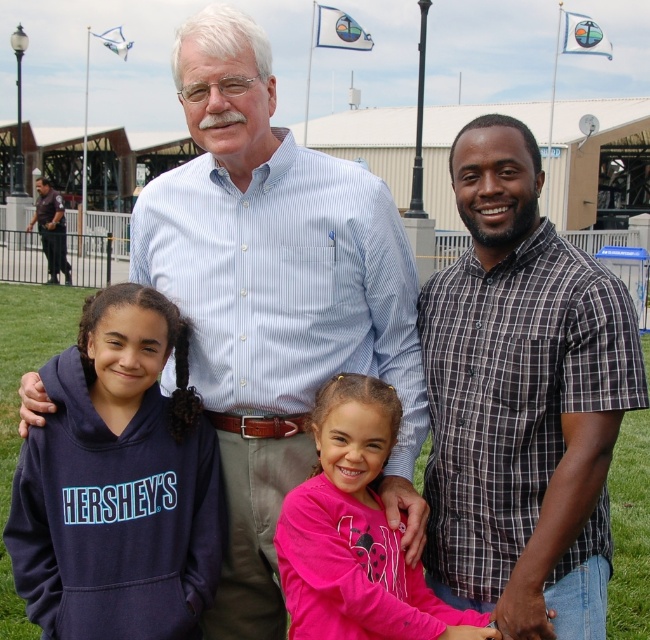
You are standing in the background of the image and want to hand a souvenir to the person wearing the navy blue hoodie at left. Which direction should you approach from relative to the light blue striped shirt at center?

You should approach from behind the light blue striped shirt at center because the navy blue hoodie at left is positioned behind the light blue striped shirt at center, so moving behind the light blue striped shirt at center will allow you to reach the navy blue hoodie at left.

You are standing at the center of the image and want to find the light blue striped shirt at center. According to the coordinates provided, in which direction should you look to locate it?

The light blue striped shirt at center is located at coordinates point (274,298), which is slightly to the right and below the center of the image. So you should look slightly to the right and downward from the center to find it.

Based on the photo, you are organizing a clothing donation drive and need to determine which of the two items, the plaid shirt at right or the navy blue hoodie at left, can fit into a standard donation box that accommodates items up to the size of the larger object. Which item should you choose?

The plaid shirt at right is larger than the navy blue hoodie at left, so you should choose the plaid shirt at right to fit into the donation box since it is the larger item and the box can accommodate its size.